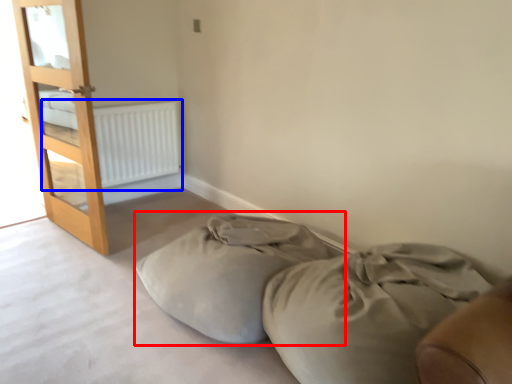
Question: Which of the following is the closest to the observer, bean bag chair (highlighted by a red box) or radiator (highlighted by a blue box)?

Choices:
 (A) bean bag chair
 (B) radiator

Answer: (A)